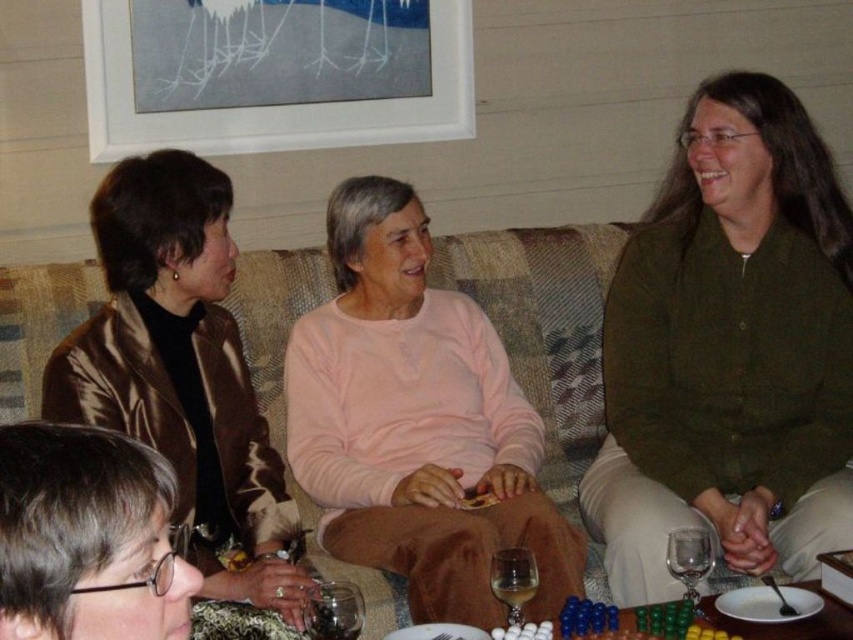
You are a delivery person holding a package that requires a surface to place it on. You see the green cotton shirt at right and the translucent glass table at lower center. Which object is closer to you where you can place the package?

The translucent glass table at lower center is closer to you than the green cotton shirt at right. You can place the package on the translucent glass table at lower center.

You are a photographer setting up a tripod in this living room. You need to position it so that both the satin brown jacket at left and the white matte picture frame at upper center are visible in the shot. Which object should be placed higher in the frame to ensure both are captured properly?

The white matte picture frame at upper center should be placed higher in the frame since the satin brown jacket at left is located below it, allowing both to be visible.